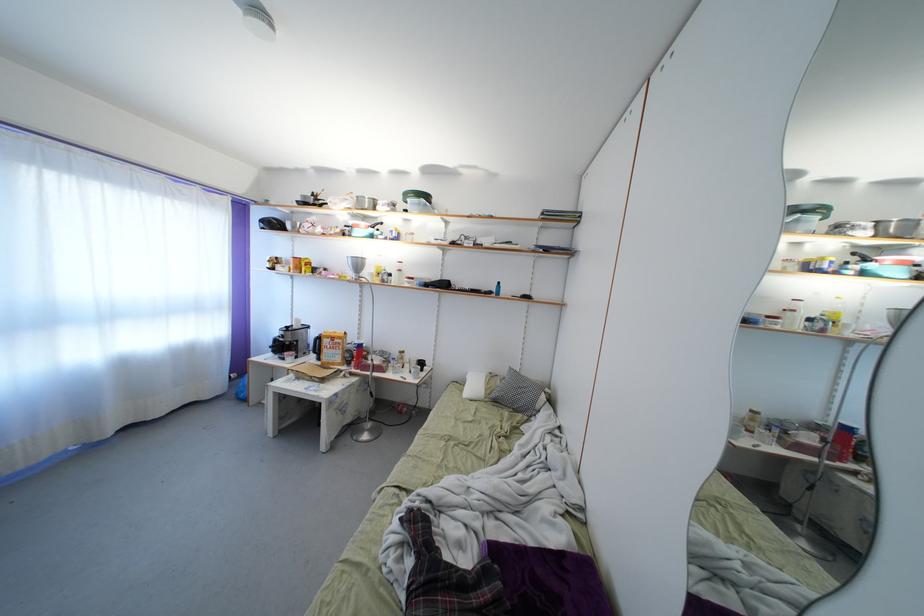
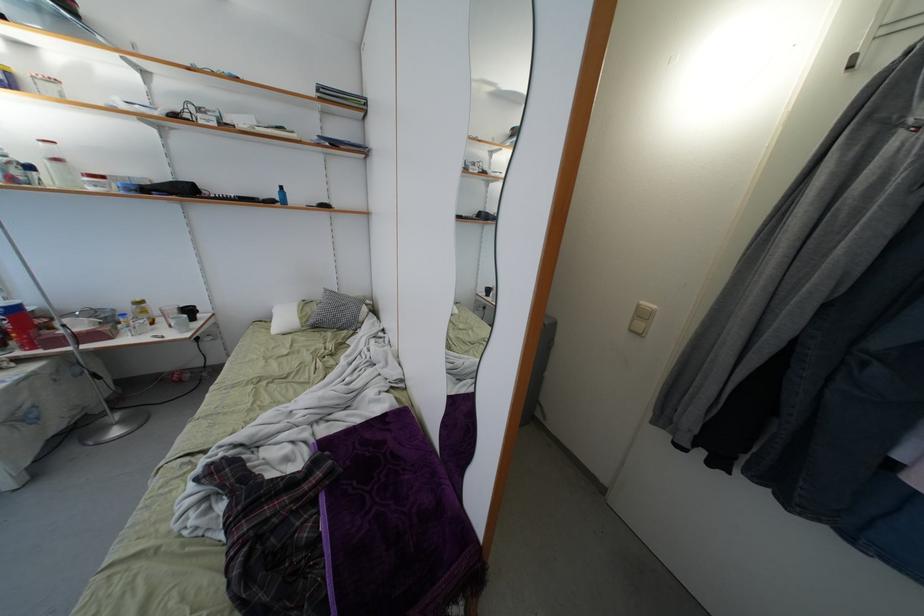
In the second image, find the point that corresponds to (362,361) in the first image.

(22, 333)